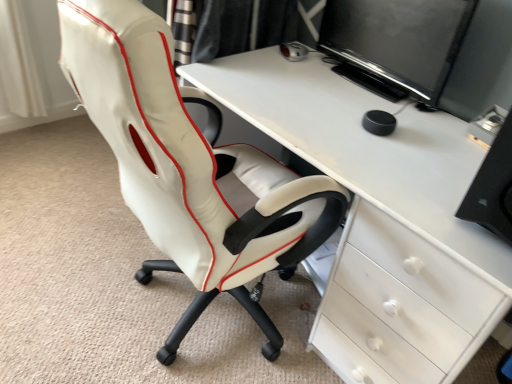
You are a GUI agent. You are given a task and a screenshot of the screen. Output one action in this format:
    pyautogui.click(x=<x>, y=<y>)
    Task: Click on the vacant space that's between black glossy monitor at upper right and black plastic computer tower at right
    
    Given the screenshot: What is the action you would take?
    pyautogui.click(x=412, y=132)